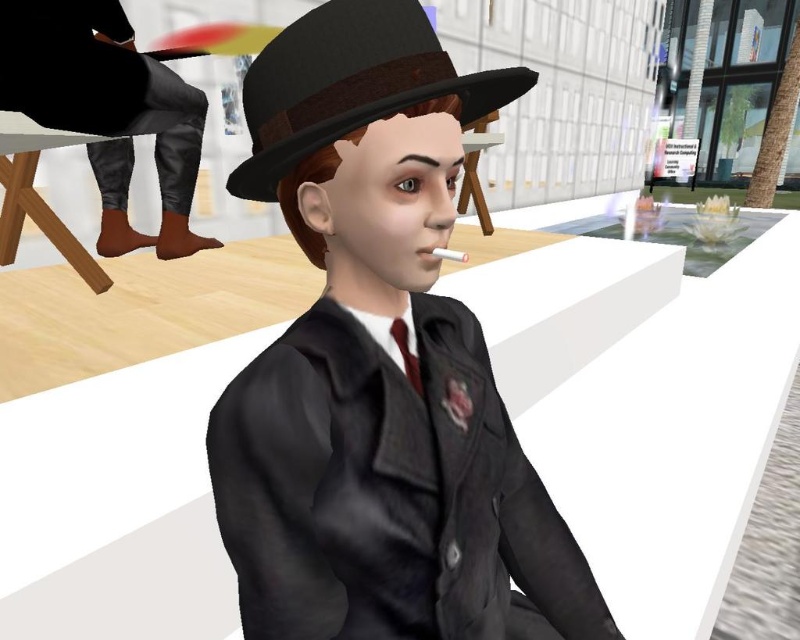
You need to choose an item to place in a display case that can only accommodate items smaller than the other. Which item from the leather pants at left and the matte brown fedora at center should you choose?

The matte brown fedora at center is smaller in size than the leather pants at left, so you should choose the matte brown fedora at center for the display case.

You are a fashion designer analyzing the outfit of the character in the image. Which item, the leather pants at left or the dark red satin tie at center, is taller in the image?

The leather pants at left is taller than the dark red satin tie at center according to the description.